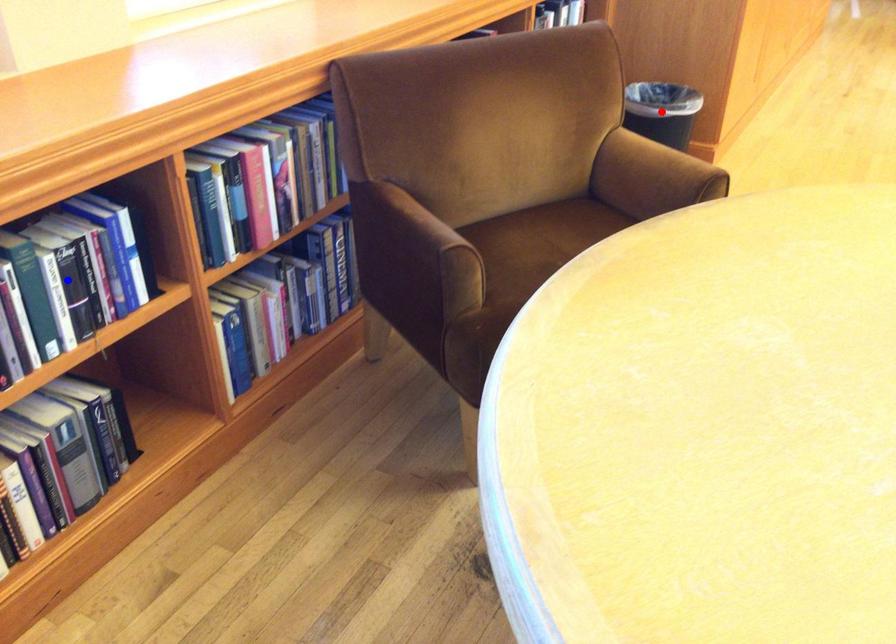
Question: Two points are marked on the image. Which point is closer to the camera?

Choices:
 (A) Blue point is closer.
 (B) Red point is closer.

Answer: (A)